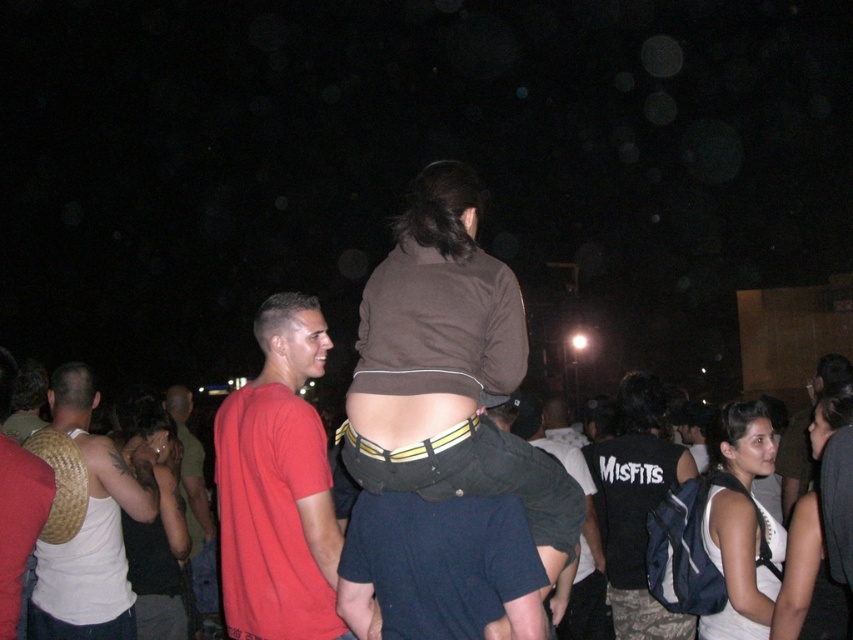
Question: Does white woven bag at back left have a smaller size compared to white matte tank top at lower right?

Choices:
 (A) yes
 (B) no

Answer: (B)

Question: Does dark blue t-shirt at center have a larger size compared to white matte tank top at lower right?

Choices:
 (A) no
 (B) yes

Answer: (B)

Question: Estimate the real-world distances between objects in this image. Which object is farther from the dark gray fabric shorts at center?

Choices:
 (A) matte black tank top at lower left
 (B) dark blue t-shirt at center
 (C) brown matte shirt at center
 (D) matte red t-shirt at center

Answer: (A)

Question: Which is farther from the matte brown wicker basket at left?

Choices:
 (A) red cotton t-shirt at center
 (B) matte black tank top at lower left

Answer: (A)

Question: Where is white fabric backpack at lower right located in relation to matte brown wicker basket at left in the image?

Choices:
 (A) left
 (B) right

Answer: (B)

Question: Considering the real-world distances, which object is closest to the white fabric backpack at lower right?

Choices:
 (A) dark gray fabric shorts at center
 (B) white woven bag at back left
 (C) matte brown wicker basket at left

Answer: (A)